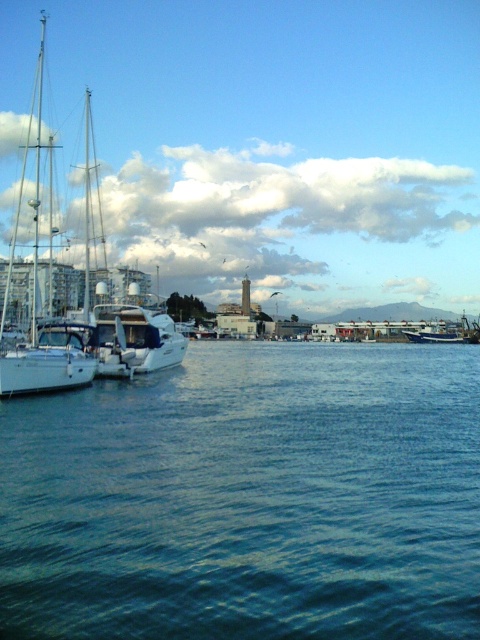
How far apart are blue water at lower left and white glossy sailboat at left?

A distance of 31.43 meters exists between blue water at lower left and white glossy sailboat at left.

Is blue water at lower left taller than white glossy sailboat at left?

Incorrect, blue water at lower left's height is not larger of white glossy sailboat at left's.

Which is behind, point (398, 524) or point (0, 364)?

Point (0, 364)

Locate an element on the screen. This screenshot has height=640, width=480. blue water at lower left is located at coordinates 249,499.

Between blue water at lower left and blue matte boat at center, which one has more height?

Standing taller between the two is blue matte boat at center.

Based on the photo, which is above, blue water at lower left or blue matte boat at center?

blue matte boat at center is above.

Describe the element at coordinates (249, 499) in the screenshot. I see `blue water at lower left` at that location.

The height and width of the screenshot is (640, 480). I want to click on blue water at lower left, so click(x=249, y=499).

Is white glossy sailboat at left shorter than blue matte boat at center?

No, white glossy sailboat at left is not shorter than blue matte boat at center.

Identify the location of white glossy sailboat at left. (48, 321).

Describe the element at coordinates (48, 321) in the screenshot. The width and height of the screenshot is (480, 640). I see `white glossy sailboat at left` at that location.

Where is `white glossy sailboat at left`? The image size is (480, 640). white glossy sailboat at left is located at coordinates (48, 321).